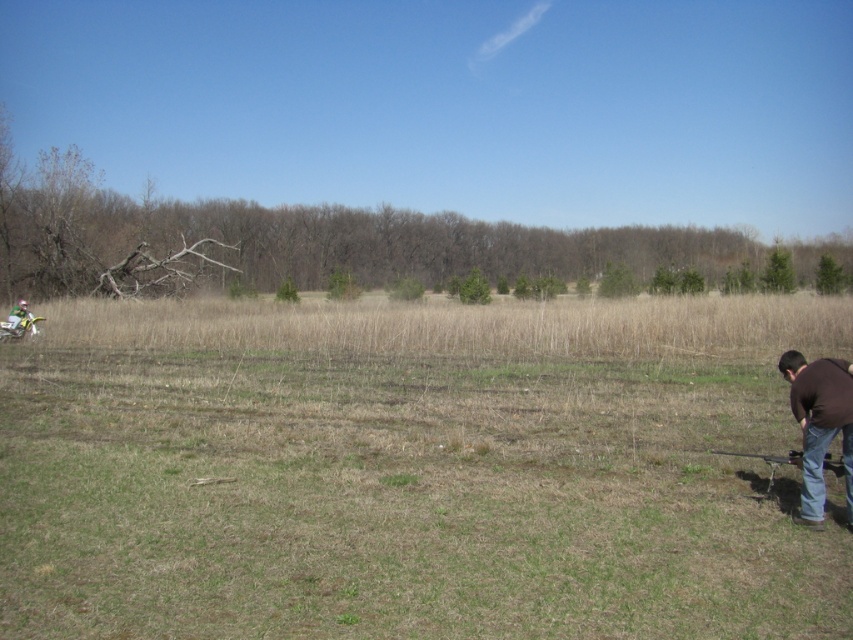
You are standing at the point marked as point (412, 472) in the image. What type of grass do you see around you?

The point (412, 472) corresponds to dry grass at center, so you see dry grass around you.

You are a hiker who wants to place a 20 meter long tent between the dry grass at center and the green matte helmet at left. Can you fit the tent between them without overlapping either object?

The distance between the dry grass at center and the green matte helmet at left is 17.45 meters, which is shorter than the 20 meter long tent. Therefore, the tent cannot be placed between them without overlapping either object.